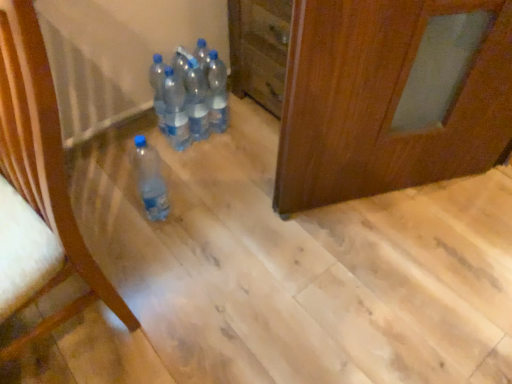
The image size is (512, 384). I want to click on vacant area that is in front of translucent plastic bottle at lower left, acting as the 4th bottle starting from the right, so click(x=149, y=253).